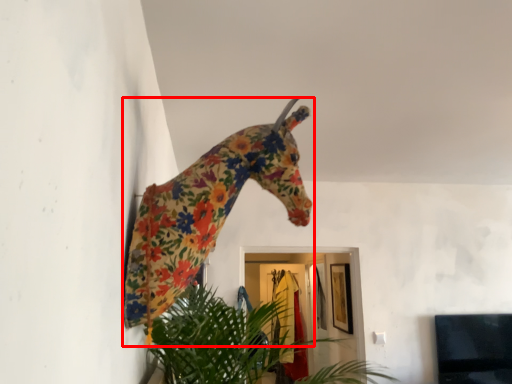
Question: In this image, where is giraffe (annotated by the red box) located relative to houseplant?

Choices:
 (A) right
 (B) left

Answer: (B)